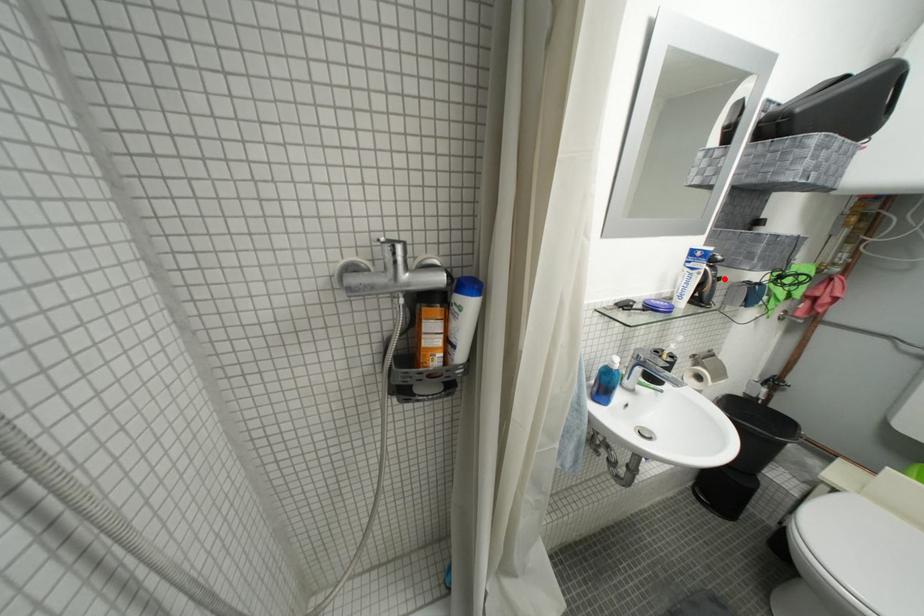
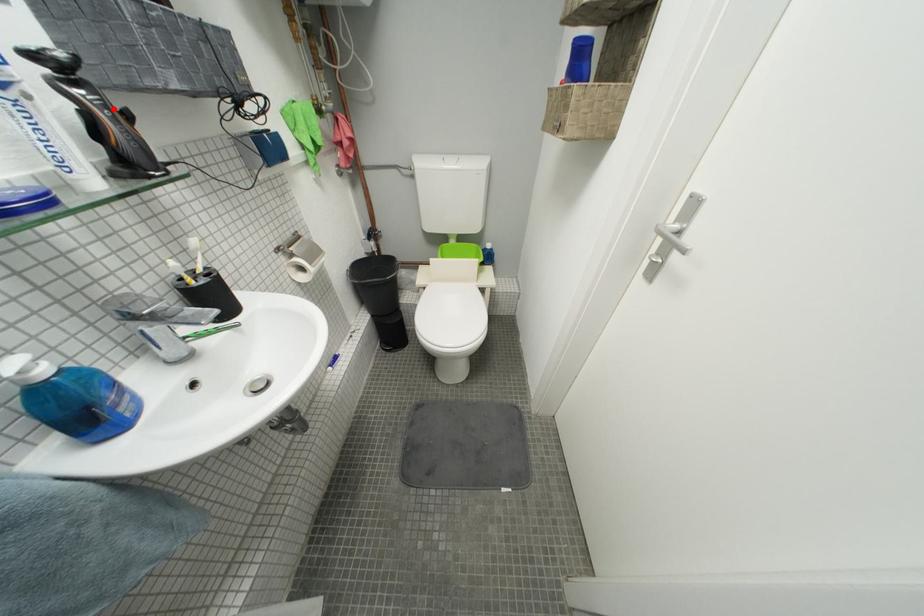
I am providing you with two images of the same scene from different viewpoints. A red point is marked on the first image and another point is marked on the second image. Is the red point in image1 aligned with the point shown in image2?

Yes